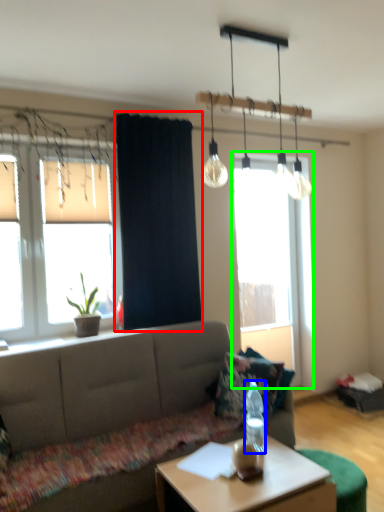
Question: Based on their relative distances, which object is nearer to curtain (highlighted by a red box)? Choose from bottle (highlighted by a blue box) and window (highlighted by a green box).

Choices:
 (A) bottle
 (B) window

Answer: (A)